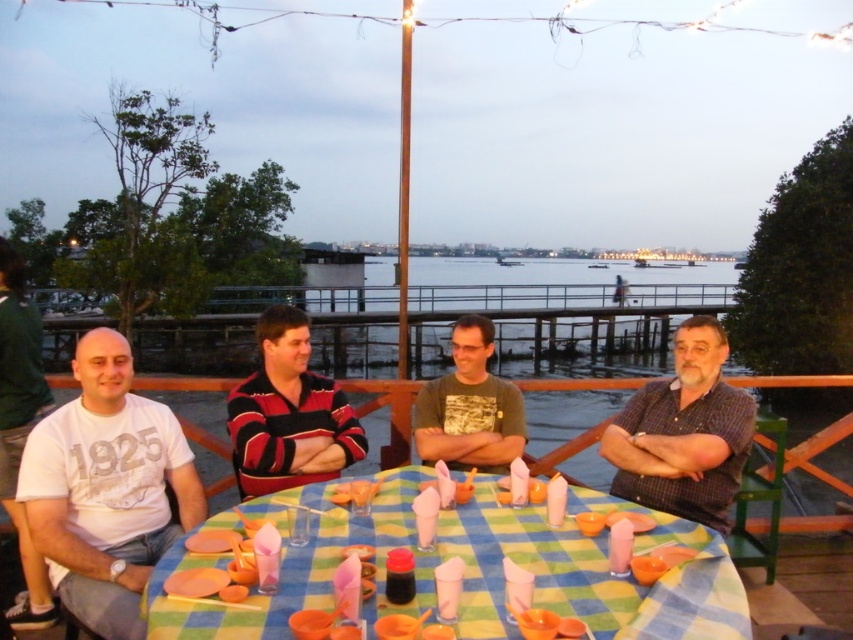
Can you confirm if checkered fabric table at center is wider than camouflage t-shirt at center?

Indeed, checkered fabric table at center has a greater width compared to camouflage t-shirt at center.

Does point (508, 528) lie behind point (502, 444)?

No, it is in front of (502, 444).

The image size is (853, 640). I want to click on checkered fabric table at center, so click(x=471, y=570).

In the scene shown: Who is positioned more to the right, white cotton t-shirt at left or camouflage t-shirt at center?

Positioned to the right is camouflage t-shirt at center.

From the picture: Is white cotton t-shirt at left below camouflage t-shirt at center?

Correct, white cotton t-shirt at left is located below camouflage t-shirt at center.

Who is more distant from viewer, (73, 580) or (486, 440)?

The point (486, 440) is more distant.

I want to click on white cotton t-shirt at left, so click(106, 488).

Which is more to the right, checkered fabric table at center or white cotton t-shirt at left?

checkered fabric table at center is more to the right.

Does checkered fabric table at center appear over white cotton t-shirt at left?

No, checkered fabric table at center is not above white cotton t-shirt at left.

At what (x,y) coordinates should I click in order to perform the action: click on checkered fabric table at center. Please return your answer as a coordinate pair (x, y). Looking at the image, I should click on (471, 570).

Image resolution: width=853 pixels, height=640 pixels. In order to click on checkered fabric table at center in this screenshot , I will do `click(471, 570)`.